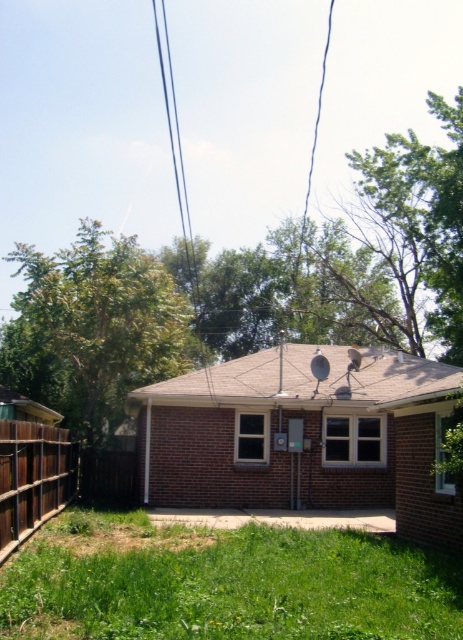
Does brown wooden fence at lower left lie in front of black wire at upper center?

Yes, brown wooden fence at lower left is closer to the viewer.

Can you confirm if brown wooden fence at lower left is bigger than black wire at upper center?

Actually, brown wooden fence at lower left might be smaller than black wire at upper center.

Image resolution: width=463 pixels, height=640 pixels. What do you see at coordinates (32, 477) in the screenshot?
I see `brown wooden fence at lower left` at bounding box center [32, 477].

This screenshot has width=463, height=640. What are the coordinates of `brown wooden fence at lower left` in the screenshot? It's located at [32, 477].

Is green grass at lower center positioned before brown wooden fence at lower left?

Yes, green grass at lower center is in front of brown wooden fence at lower left.

Who is more distant from viewer, (261, 540) or (14, 428)?

The point (261, 540) is more distant.

Describe the element at coordinates (225, 582) in the screenshot. I see `green grass at lower center` at that location.

Identify the location of green grass at lower center. (225, 582).

Is green grass at lower center positioned before black wire at upper center?

Yes, green grass at lower center is closer to the viewer.

You are a GUI agent. You are given a task and a screenshot of the screen. Output one action in this format:
    pyautogui.click(x=<x>, y=<y>)
    Task: Click on the green grass at lower center
    
    Given the screenshot: What is the action you would take?
    pyautogui.click(x=225, y=582)

You are a GUI agent. You are given a task and a screenshot of the screen. Output one action in this format:
    pyautogui.click(x=<x>, y=<y>)
    Task: Click on the green grass at lower center
    The width and height of the screenshot is (463, 640).
    Given the screenshot: What is the action you would take?
    pyautogui.click(x=225, y=582)